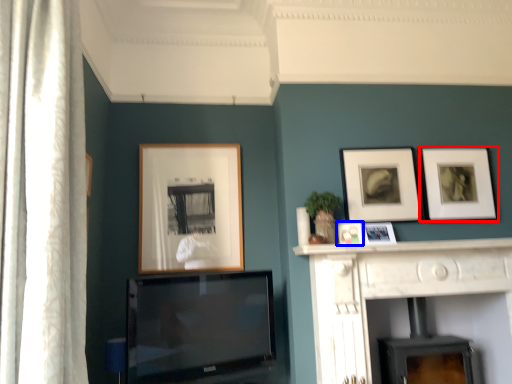
Question: Which object appears farthest to the camera in this image, picture frame (highlighted by a red box) or picture frame (highlighted by a blue box)?

Choices:
 (A) picture frame
 (B) picture frame

Answer: (A)